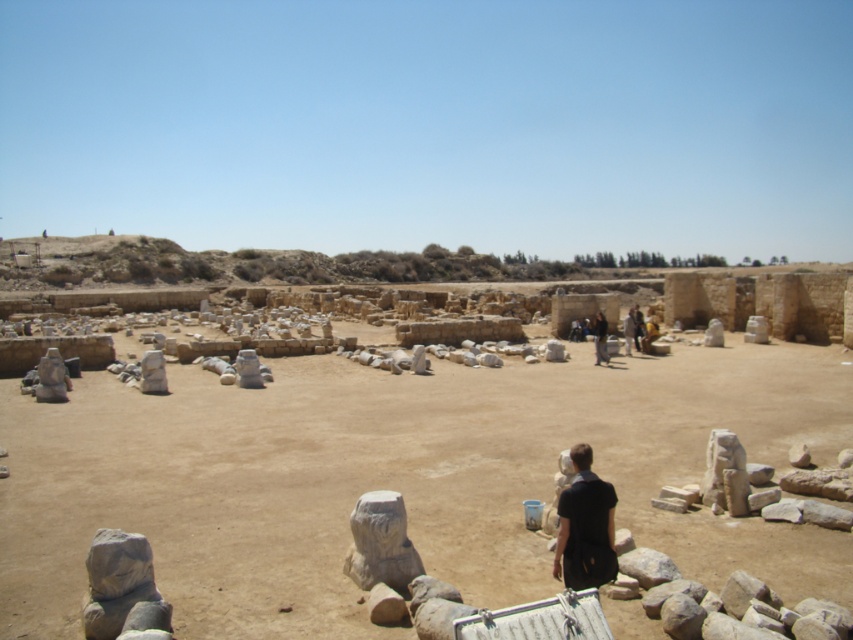
You are a tour guide at the archaeological site and want to point out the black matte shirt at center and the dark brown leather jacket at center to your visitors. Which one would you mention first if you want to start with the one closer to the group?

The black matte shirt at center is closer to the viewer than the dark brown leather jacket at center, so you should mention the black matte shirt at center first.

You are standing at the archaeological site and want to take a photo of the two points mentioned. Which point, point (732, 540) or point (605, 321), will appear larger in your camera view?

Point (732, 540) is closer to the viewer than point (605, 321), so it will appear larger in the camera view.